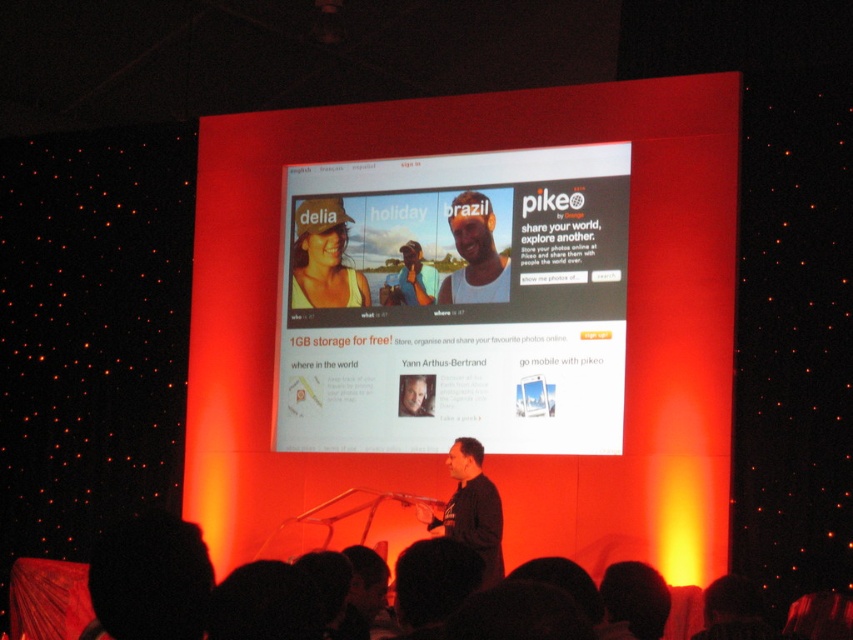
Question: Which object is positioned closest to the smooth skin portrait at center?

Choices:
 (A) white glossy screen at center
 (B) black fabric at lower center

Answer: (A)

Question: Is black fabric at lower center above black matte shirt at center?

Choices:
 (A) no
 (B) yes

Answer: (A)

Question: Is black fabric at lower center thinner than black matte shirt at center?

Choices:
 (A) yes
 (B) no

Answer: (B)

Question: Estimate the real-world distances between objects in this image. Which object is farther from the white glossy screen at center?

Choices:
 (A) black matte shirt at center
 (B) black fabric at lower center
 (C) blue denim shirt at center

Answer: (B)

Question: Is white glossy screen at center closer to the viewer compared to smooth skin portrait at center?

Choices:
 (A) no
 (B) yes

Answer: (B)

Question: Which of the following is the farthest from the observer?

Choices:
 (A) blue denim shirt at center
 (B) black matte shirt at center
 (C) matte white t-shirt at center

Answer: (A)